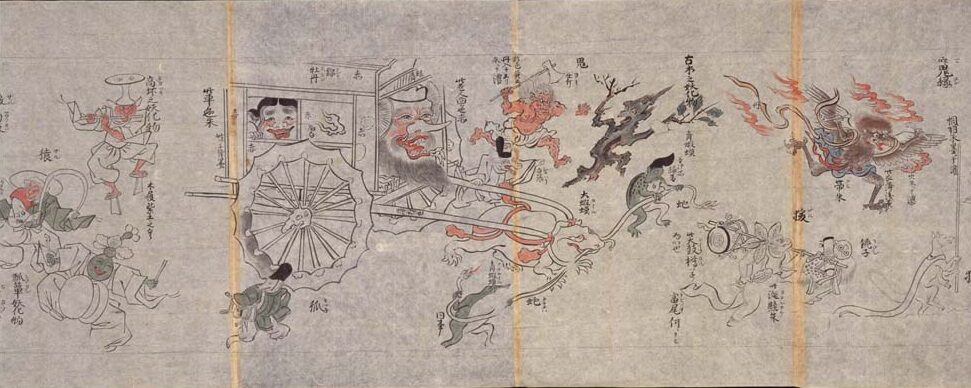
I want to click on art work, so click(531, 193).